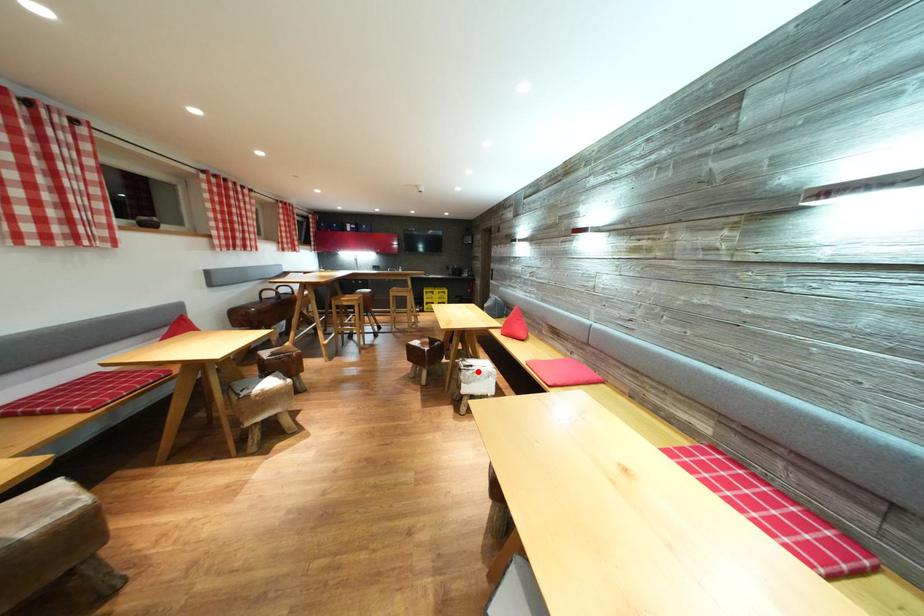
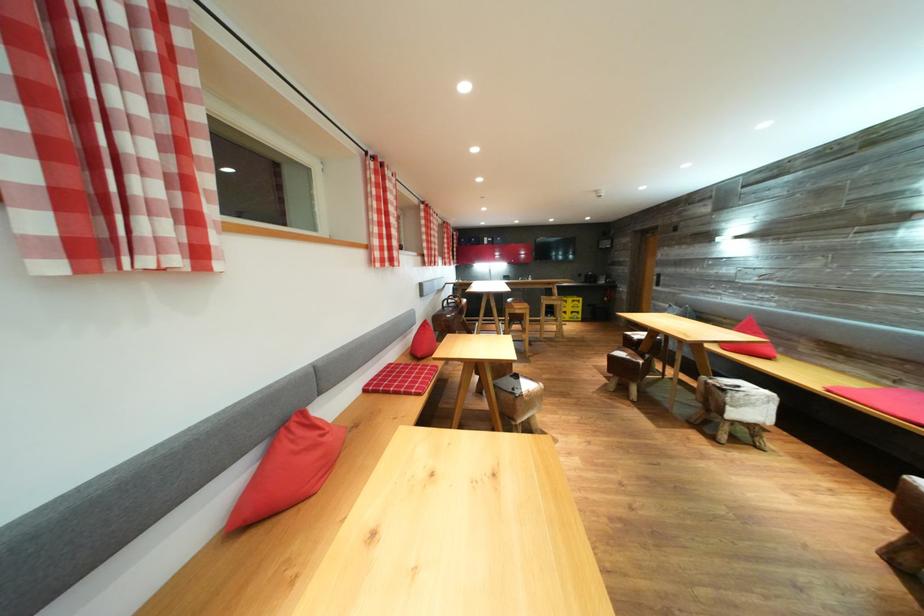
The point at the highlighted location is marked in the first image. Where is the corresponding point in the second image?

(745, 392)